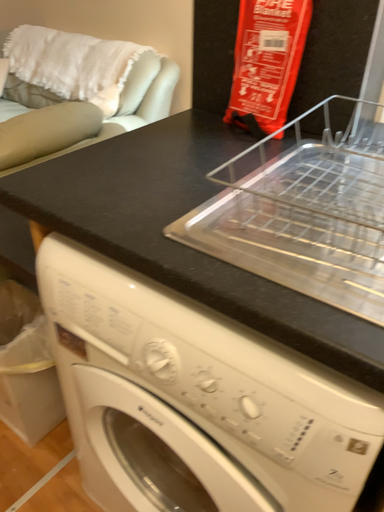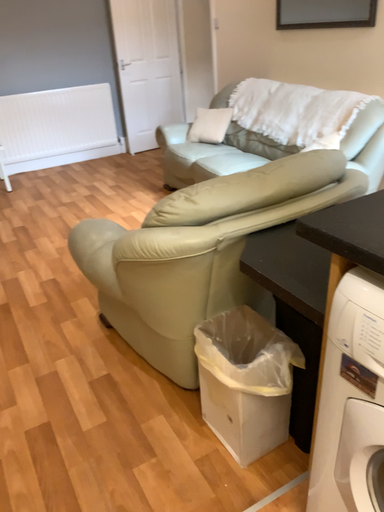
Question: Which way did the camera rotate in the video?

Choices:
 (A) rotated right
 (B) rotated left

Answer: (B)